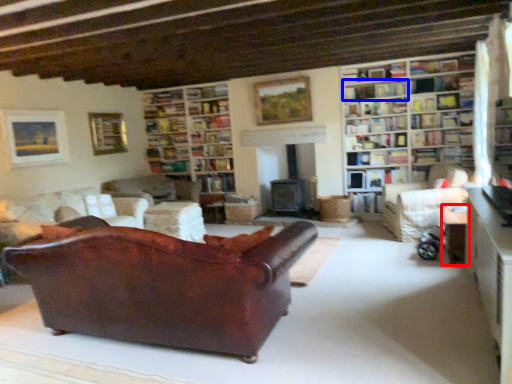
Question: Which object is further to the camera taking this photo, table (highlighted by a red box) or shelf (highlighted by a blue box)?

Choices:
 (A) table
 (B) shelf

Answer: (B)